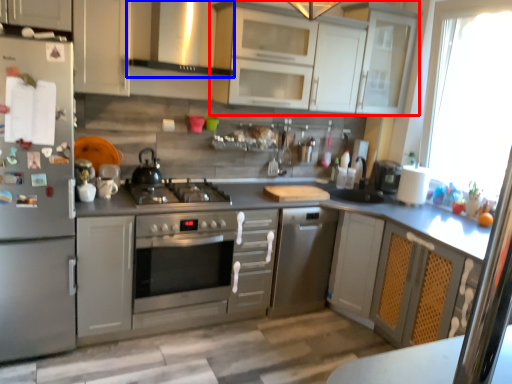
Question: Which point is closer to the camera, cabinetry (highlighted by a red box) or exhaust hood (highlighted by a blue box)?

Choices:
 (A) cabinetry
 (B) exhaust hood

Answer: (B)